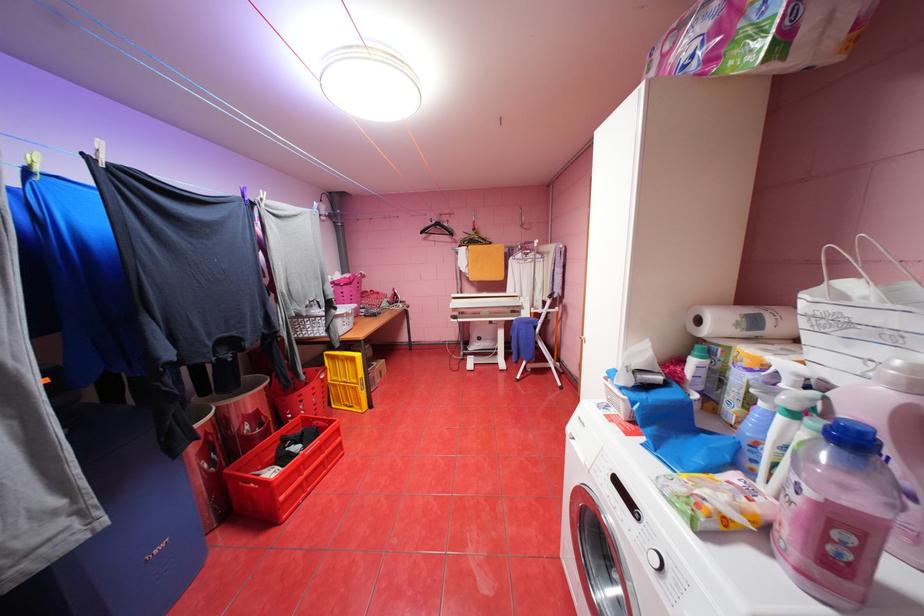
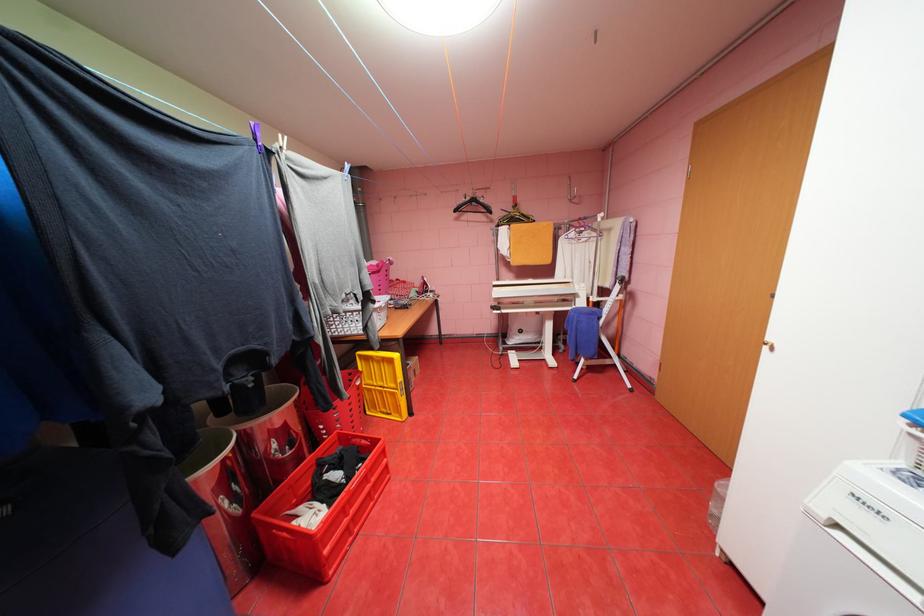
Where in the second image is the point corresponding to (532,362) from the first image?

(591, 360)